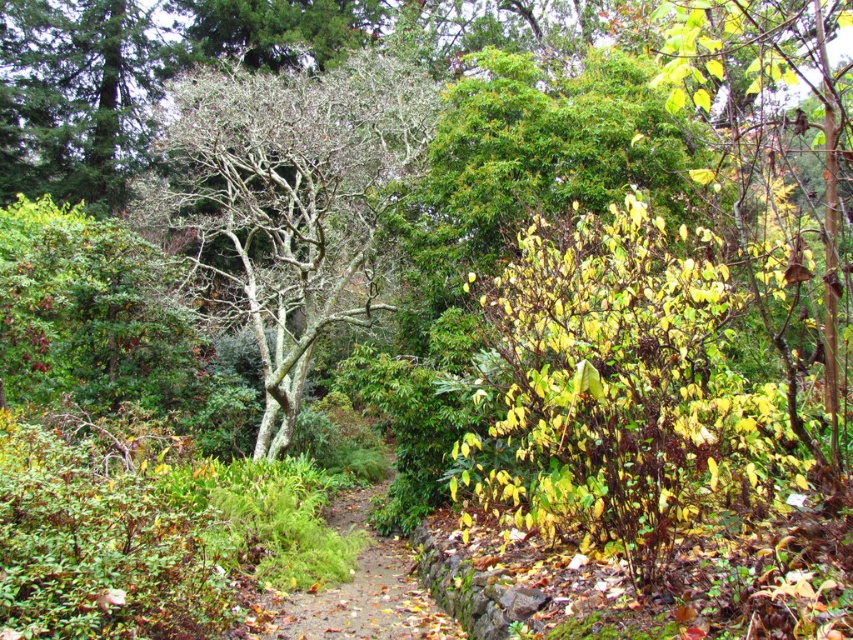
Is white bark tree at center thinner than brown dirt path at center?

In fact, white bark tree at center might be wider than brown dirt path at center.

Is point (291, 234) positioned in front of point (390, 593)?

No, (291, 234) is further to viewer.

Who is more forward, [294,177] or [376,595]?

Point [376,595] is more forward.

Where is `white bark tree at center`? The width and height of the screenshot is (853, 640). white bark tree at center is located at coordinates (289, 200).